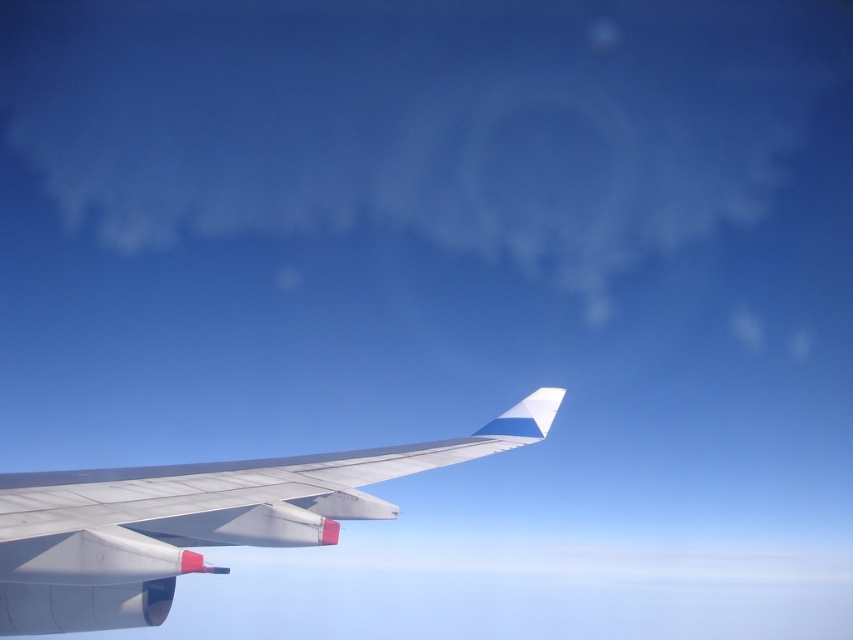
You are a pilot checking the weather conditions from the cockpit window. You notice the white fluffy cloud at upper center and the metallic gray wing at center. Which object appears bigger in the view?

The white fluffy cloud at upper center is larger in size than the metallic gray wing at center, so the cloud appears bigger in the view.

You are a pilot checking the airplane wing for potential obstructions. From your current position inside the cockpit, can you see if the white fluffy cloud at upper center is wider than the metallic gray wing at center?

The white fluffy cloud at upper center might be wider than metallic gray wing at center according to the description, so there is a possibility that the cloud is wider than the wing.